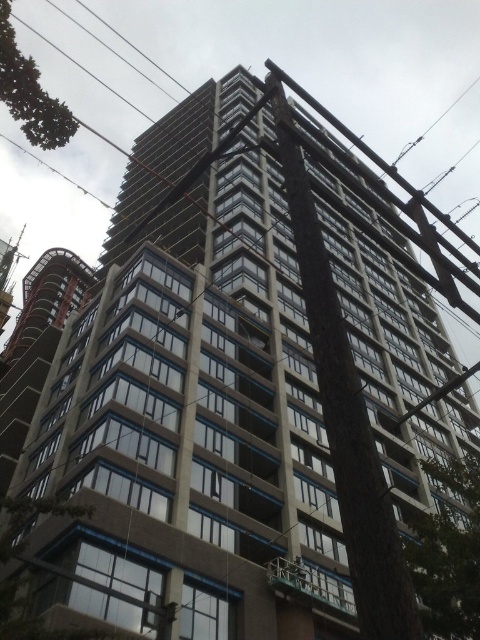
You are an architect planning to install a new light pole between the green leafy tree at lower right and the green leafy tree at upper left. Considering their widths, which tree should the pole be closer to to ensure it doesn

The green leafy tree at lower right is wider than the green leafy tree at upper left. To ensure the light pole is closer to the wider tree, it should be positioned nearer to the green leafy tree at lower right.

You are an architect reviewing the construction site. You notice the green leafy tree at lower right and the black wire at upper left. Which object is closer to the ground?

The green leafy tree at lower right is closer to the ground since it is shorter than the black wire at upper left.

You are a construction worker standing at the base of the building. You notice the concrete at center and the green leafy tree at upper left. Which object is taller?

The concrete at center is taller than the green leafy tree at upper left according to the description.